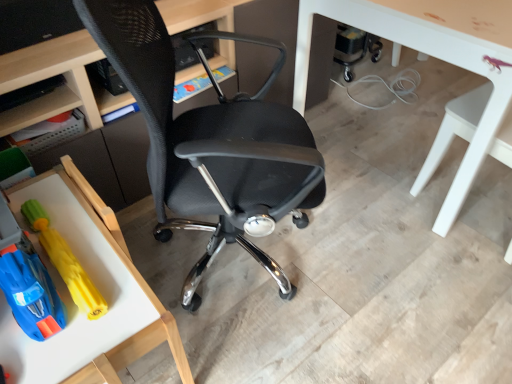
Question: Is rubberized yellow toy at lower left, the first toy positioned from the left, taller or shorter than matte black shelf at upper left?

Choices:
 (A) short
 (B) tall

Answer: (B)

Question: Considering the relative positions of rubberized yellow toy at lower left, the first toy positioned from the left, and matte black shelf at upper left in the image provided, is rubberized yellow toy at lower left, the first toy positioned from the left, to the left or to the right of matte black shelf at upper left?

Choices:
 (A) right
 (B) left

Answer: (A)

Question: Based on their relative distances, which object is farther from the wooden tray at lower left, arranged as the first table when viewed from the left?

Choices:
 (A) white glossy table at lower right, the second table ordered from the bottom
 (B) rubberized yellow toy at lower left, the first toy positioned from the left
 (C) matte black desk at center
 (D) white glossy table at right, which ranks as the first chair in right-to-left order
 (E) black mesh chair at center, which appears as the 1th chair when viewed from the left

Answer: (D)

Question: Considering the real-world distances, which object is farthest from the wooden tray at lower left, which is the first table in bottom-to-top order?

Choices:
 (A) yellow rubber toy at lower left, marked as the second toy in a left-to-right arrangement
 (B) matte black desk at center
 (C) white glossy table at lower right, marked as the 1th table in a top-to-bottom arrangement
 (D) rubberized yellow toy at lower left, the second toy when ordered from right to left
 (E) black mesh chair at center, which appears as the 1th chair when viewed from the left

Answer: (C)